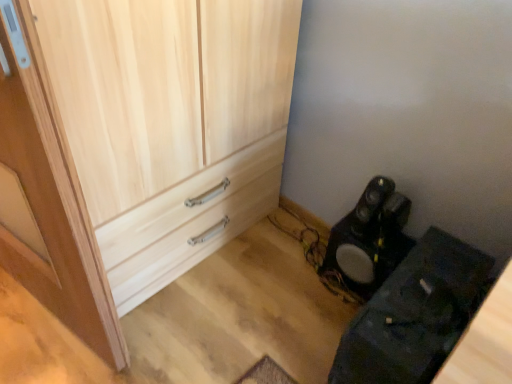
Question: From a real-world perspective, is natural wood cupboard at center positioned over wooden door at left based on gravity?

Choices:
 (A) no
 (B) yes

Answer: (A)

Question: From the image's perspective, is natural wood cupboard at center under wooden door at left?

Choices:
 (A) no
 (B) yes

Answer: (A)

Question: Is natural wood cupboard at center positioned beyond the bounds of wooden door at left?

Choices:
 (A) yes
 (B) no

Answer: (A)

Question: Is natural wood cupboard at center to the right of wooden door at left from the viewer's perspective?

Choices:
 (A) yes
 (B) no

Answer: (A)

Question: Is natural wood cupboard at center wider than wooden door at left?

Choices:
 (A) no
 (B) yes

Answer: (B)

Question: Considering the relative sizes of natural wood cupboard at center and wooden door at left in the image provided, is natural wood cupboard at center thinner than wooden door at left?

Choices:
 (A) yes
 (B) no

Answer: (B)

Question: Is natural wood cupboard at center surrounding black matte speaker at lower right?

Choices:
 (A) no
 (B) yes

Answer: (A)

Question: Is natural wood cupboard at center outside black matte speaker at lower right?

Choices:
 (A) yes
 (B) no

Answer: (A)

Question: Is natural wood cupboard at center touching black matte speaker at lower right?

Choices:
 (A) yes
 (B) no

Answer: (B)

Question: Considering the relative sizes of natural wood cupboard at center and black matte speaker at lower right in the image provided, is natural wood cupboard at center thinner than black matte speaker at lower right?

Choices:
 (A) no
 (B) yes

Answer: (A)

Question: Is natural wood cupboard at center positioned behind black matte speaker at lower right?

Choices:
 (A) yes
 (B) no

Answer: (B)

Question: Can you confirm if natural wood cupboard at center is wider than black matte speaker at lower right?

Choices:
 (A) no
 (B) yes

Answer: (B)

Question: Is black matte speaker at lower right located within wooden door at left?

Choices:
 (A) no
 (B) yes

Answer: (A)